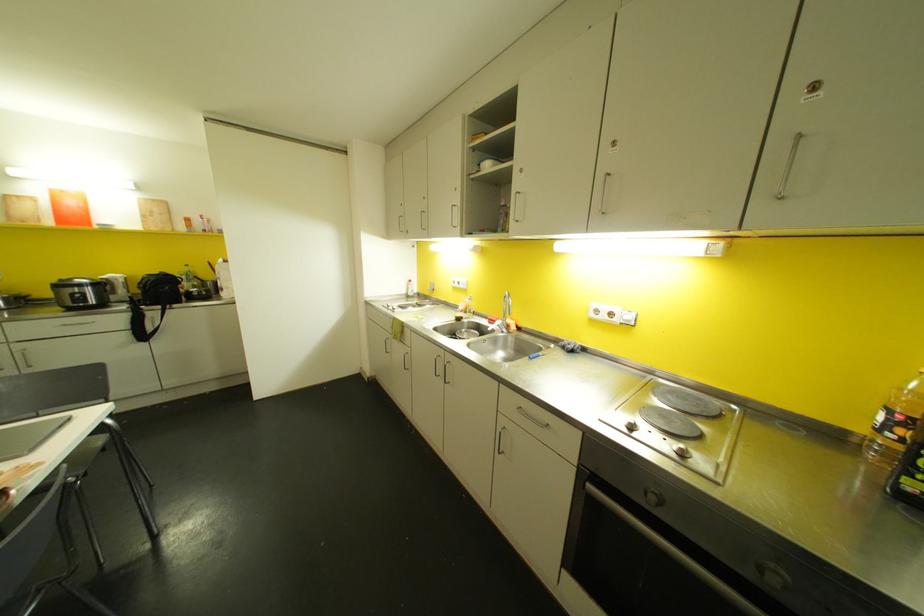
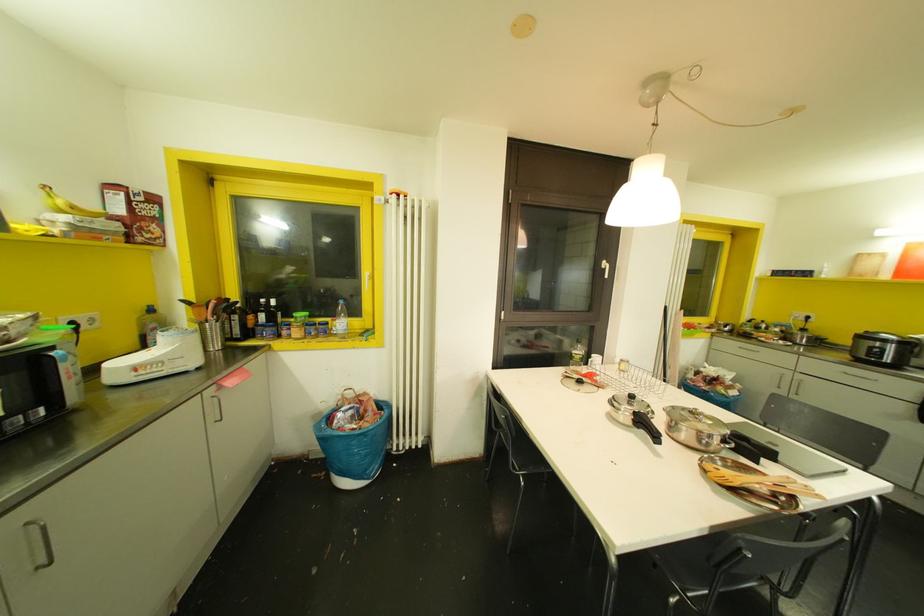
Where in the second image is the point corresponding to point 58,286 from the first image?

(861, 336)